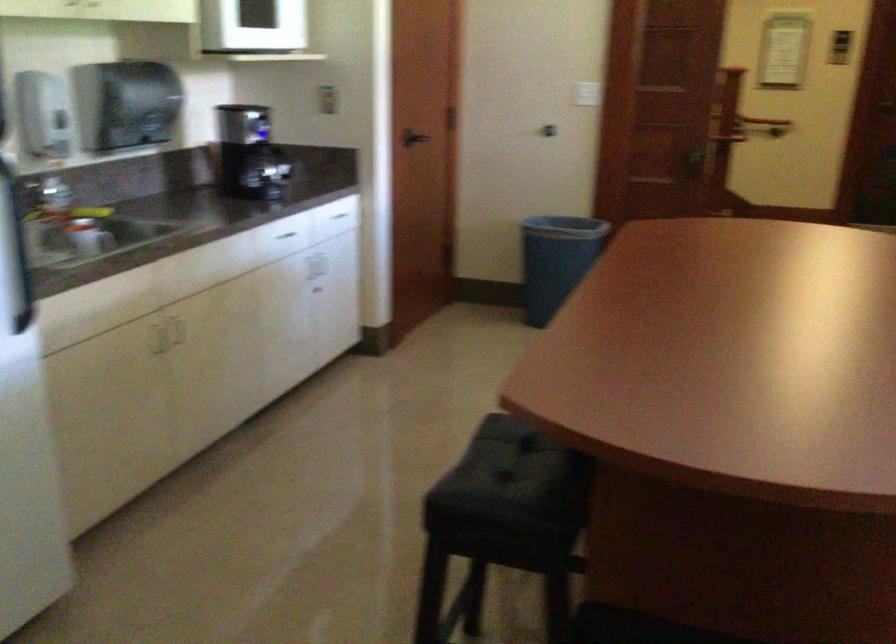
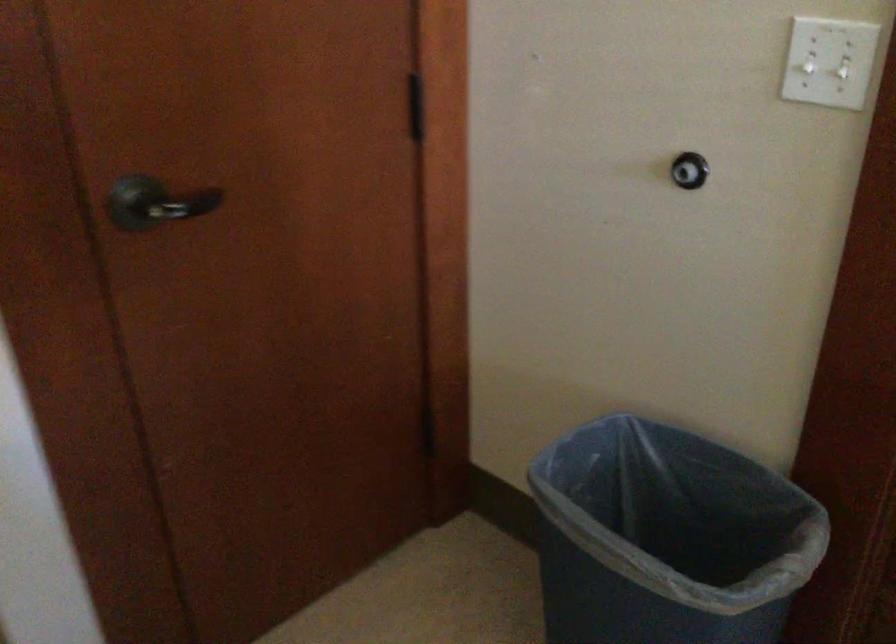
Question: I am providing you with two images of the same scene from different viewpoints. Please identify which objects are invisible in image2.

Choices:
 (A) white light switch
 (B) black door handle
 (C) blue trash can
 (D) none of these

Answer: (D)